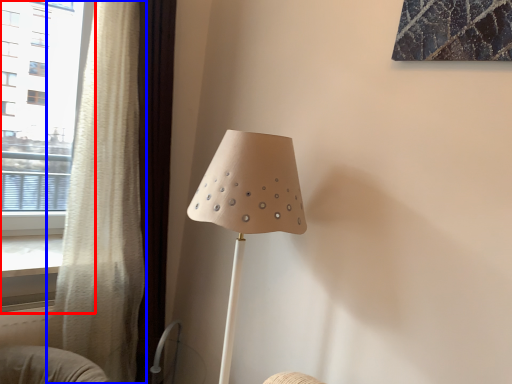
Question: Which object appears closest to the camera in this image, window (highlighted by a red box) or curtain (highlighted by a blue box)?

Choices:
 (A) window
 (B) curtain

Answer: (B)